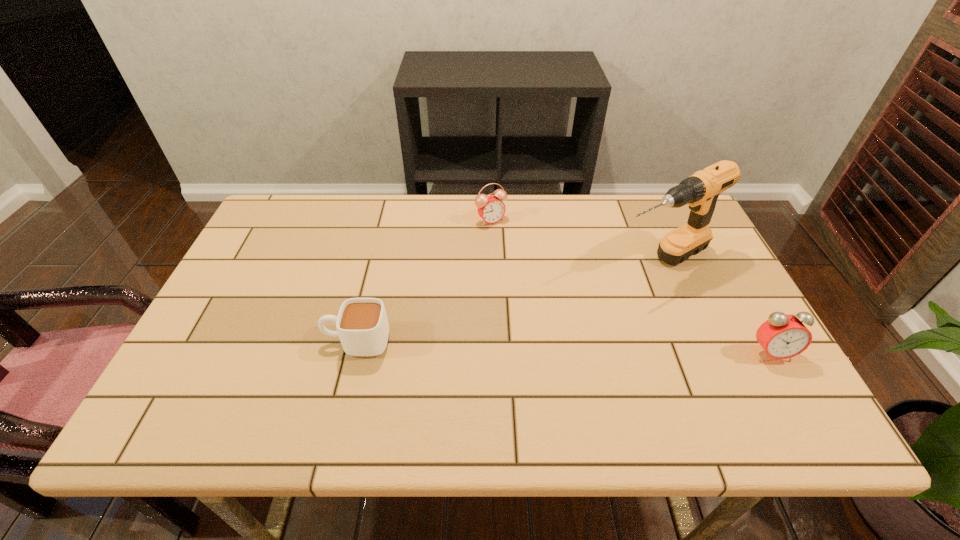
At what (x,y) coordinates should I click in order to perform the action: click on the shortest object. Please return your answer as a coordinate pair (x, y). The image size is (960, 540). Looking at the image, I should click on (362, 325).

This screenshot has height=540, width=960. I want to click on cup, so click(362, 325).

You are a GUI agent. You are given a task and a screenshot of the screen. Output one action in this format:
    pyautogui.click(x=<x>, y=<y>)
    Task: Click on the nearer alarm clock
    The width and height of the screenshot is (960, 540).
    Given the screenshot: What is the action you would take?
    pyautogui.click(x=782, y=336)

The width and height of the screenshot is (960, 540). I want to click on the farthest object, so click(491, 209).

At what (x,y) coordinates should I click in order to perform the action: click on the farther alarm clock. Please return your answer as a coordinate pair (x, y). The image size is (960, 540). Looking at the image, I should click on (491, 209).

The height and width of the screenshot is (540, 960). I want to click on the tallest object, so click(x=700, y=192).

This screenshot has width=960, height=540. I want to click on the third nearest object, so click(x=700, y=192).

Image resolution: width=960 pixels, height=540 pixels. In order to click on vacant space located 0.230m on the side with the handle of the leftmost object in this screenshot , I will do pos(228,341).

Where is `vacant area situated 0.150m on the side with the handle of the leftmost object`? vacant area situated 0.150m on the side with the handle of the leftmost object is located at coordinates (261, 341).

This screenshot has height=540, width=960. I want to click on vacant space located on the side with the handle of the leftmost object, so click(x=252, y=341).